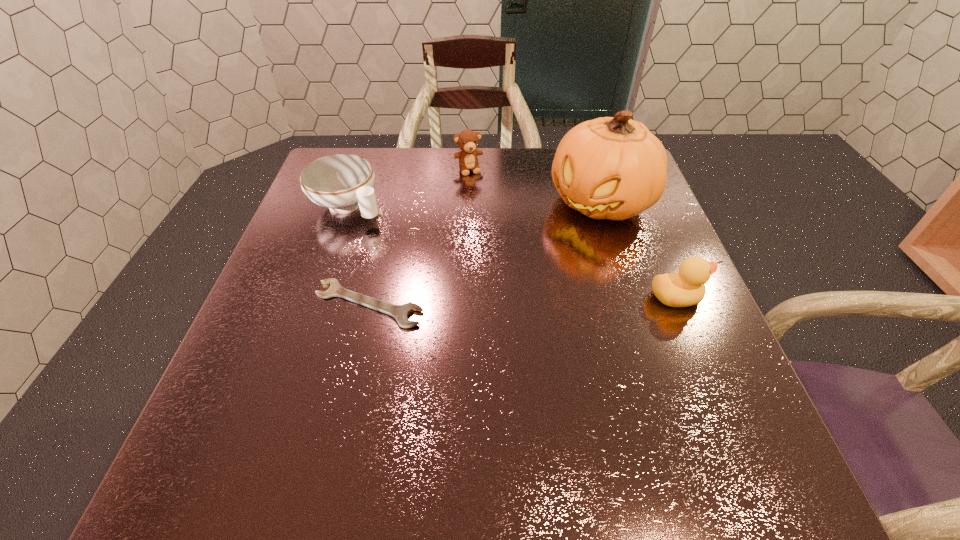
The width and height of the screenshot is (960, 540). I want to click on object that can be found as the closest to the duckling, so click(614, 168).

The width and height of the screenshot is (960, 540). Identify the location of vacant space that satisfies the following two spatial constraints: 1. on the back side of the duckling; 2. on the face of the wrench. (371, 297).

Where is `free spot that satisfies the following two spatial constraints: 1. on the back side of the shortest object; 2. on the right side of the pumpkin`? This screenshot has width=960, height=540. free spot that satisfies the following two spatial constraints: 1. on the back side of the shortest object; 2. on the right side of the pumpkin is located at coordinates (392, 202).